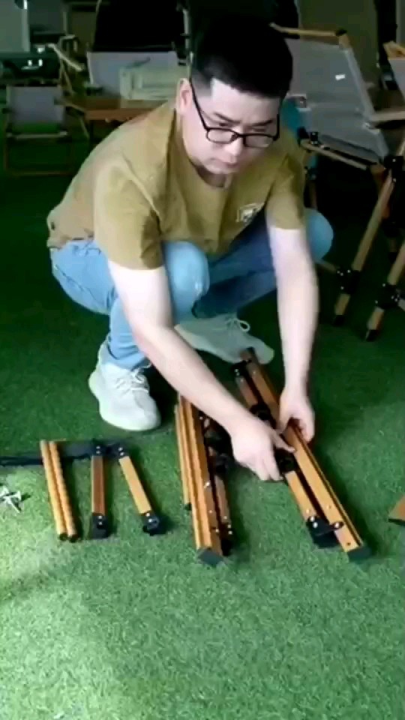
I want to click on chair, so click(347, 91).